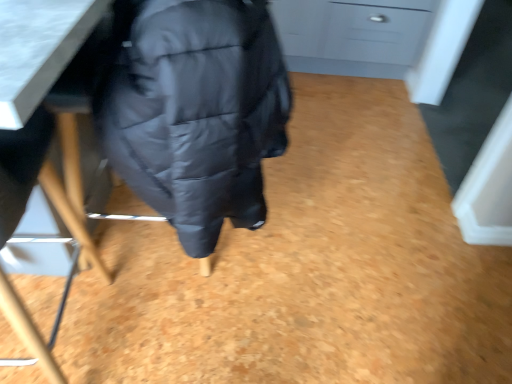
At what (x,y) coordinates should I click in order to perform the action: click on vacant space to the right of matte black chair at lower left. Please return your answer as a coordinate pair (x, y). Image resolution: width=512 pixels, height=384 pixels. Looking at the image, I should click on (192, 335).